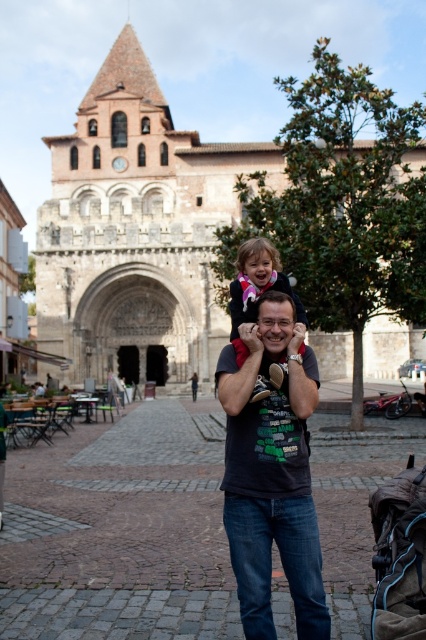
Question: Is smooth stone pavement at center to the left of brown stone church at center from the viewer's perspective?

Choices:
 (A) yes
 (B) no

Answer: (A)

Question: Does brown stone church at center have a larger size compared to matte pink sweater at center?

Choices:
 (A) yes
 (B) no

Answer: (A)

Question: Considering the real-world distances, which object is farthest from the brown fabric baby carriage at lower right?

Choices:
 (A) dark gray t-shirt at center
 (B) brown stone church at center
 (C) smooth stone pavement at center
 (D) matte pink sweater at center

Answer: (B)

Question: Among these objects, which one is nearest to the camera?

Choices:
 (A) matte pink sweater at center
 (B) brown stone church at center

Answer: (A)

Question: Is brown stone church at center closer to camera compared to matte pink sweater at center?

Choices:
 (A) yes
 (B) no

Answer: (B)

Question: Considering the real-world distances, which object is farthest from the matte pink sweater at center?

Choices:
 (A) brown stone church at center
 (B) smooth stone pavement at center
 (C) dark gray t-shirt at center
 (D) brown fabric baby carriage at lower right

Answer: (A)